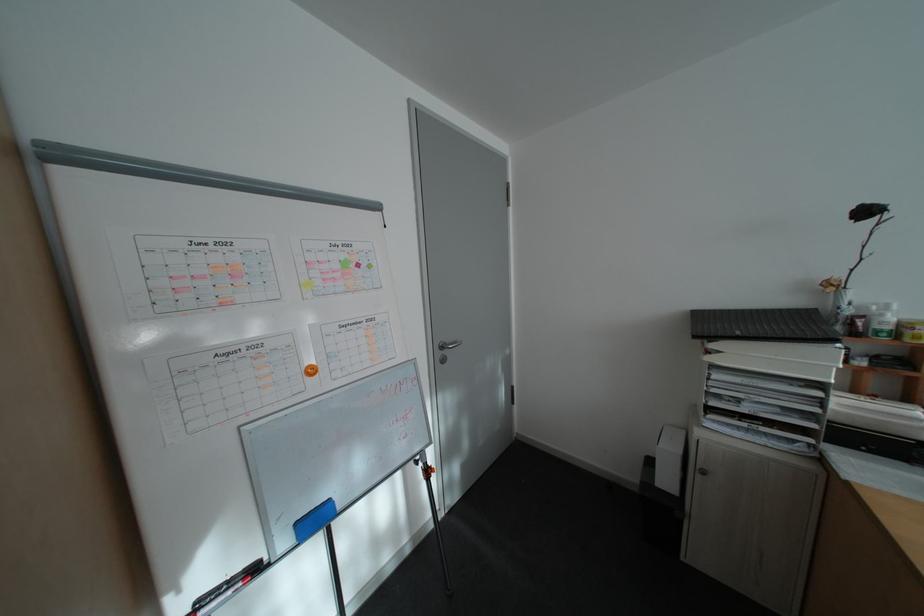
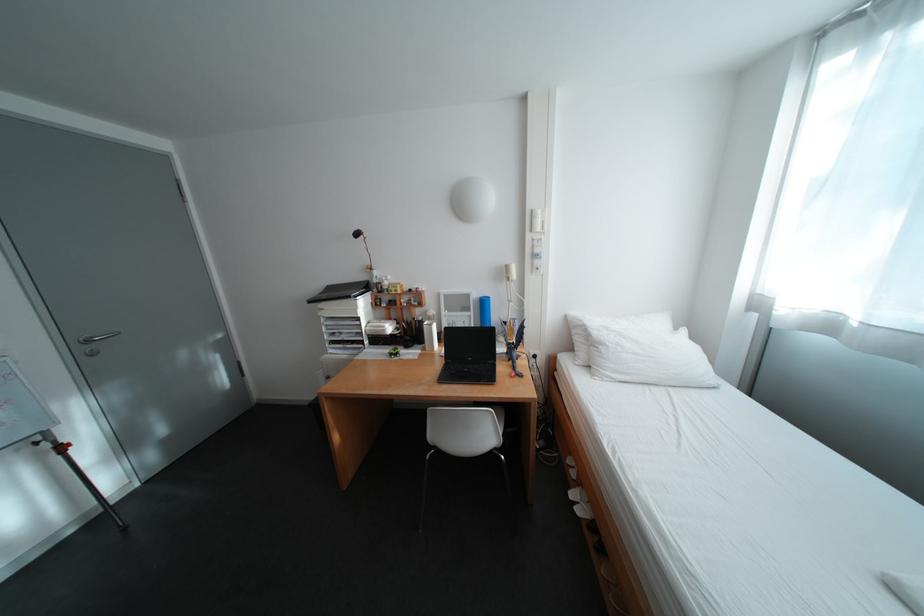
Find the pixel in the second image that matches [757,405] in the first image.

(355, 336)